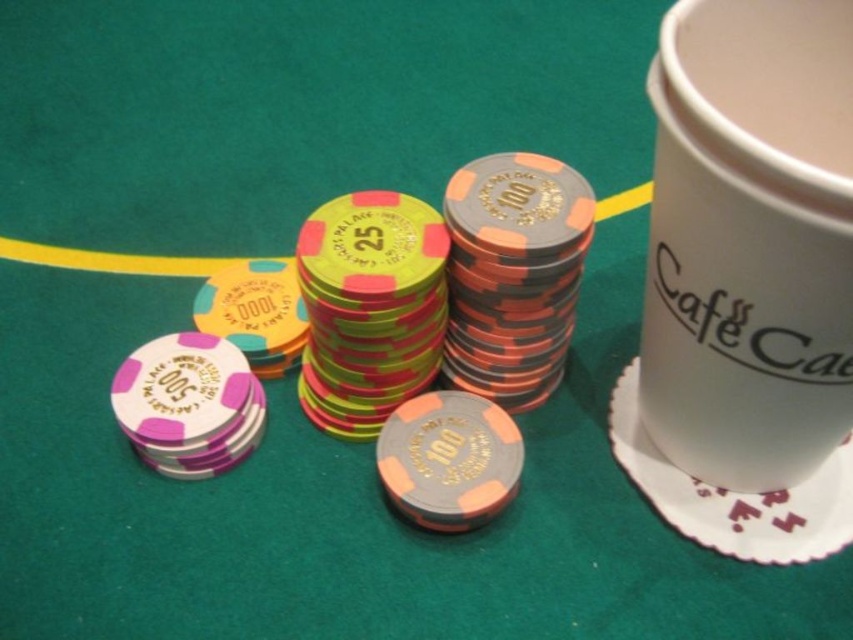
Question: Is white paper cup at right to the right of white paper saucer at upper right from the viewer's perspective?

Choices:
 (A) no
 (B) yes

Answer: (A)

Question: Which object appears closest to the camera in this image?

Choices:
 (A) white paper cup at right
 (B) white paper saucer at upper right

Answer: (A)

Question: Is white paper cup at right thinner than white paper saucer at upper right?

Choices:
 (A) no
 (B) yes

Answer: (B)

Question: Is the position of white paper cup at right less distant than that of white paper saucer at upper right?

Choices:
 (A) yes
 (B) no

Answer: (A)

Question: Which object appears closest to the camera in this image?

Choices:
 (A) white paper cup at right
 (B) white paper saucer at upper right

Answer: (A)

Question: Which point is closer to the camera?

Choices:
 (A) white paper saucer at upper right
 (B) white paper cup at right

Answer: (B)